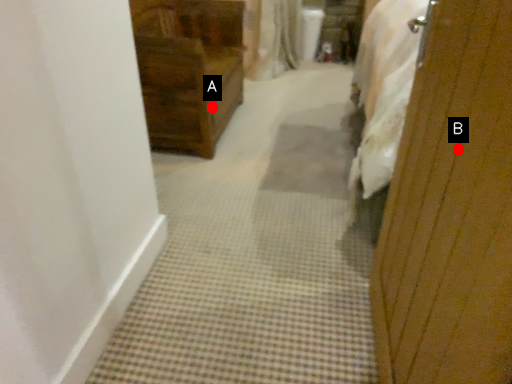
Question: Two points are circled on the image, labeled by A and B beside each circle. Which point appears closest to the camera in this image?

Choices:
 (A) A is closer
 (B) B is closer

Answer: (B)